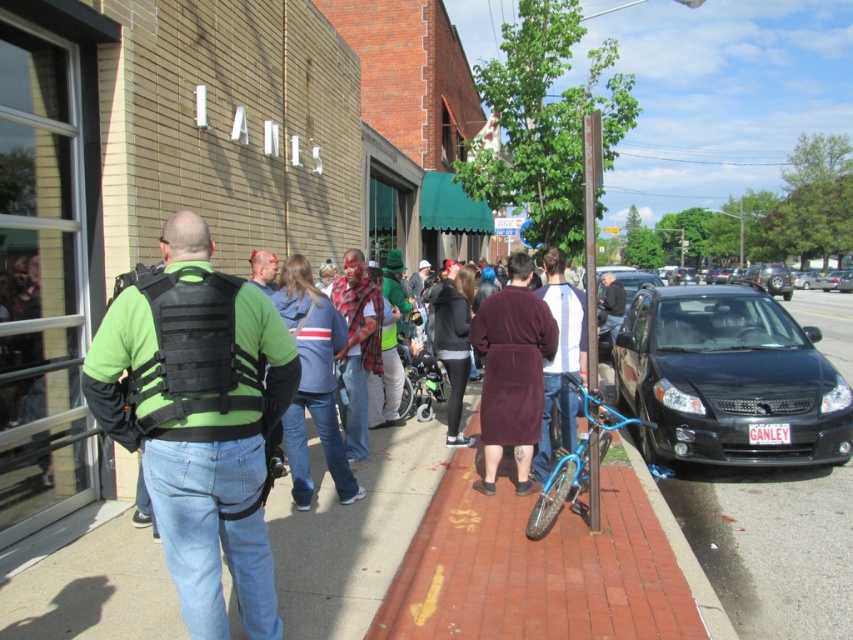
What are the coordinates of the black glossy sedan at right?

The black glossy sedan at right is located at coordinates point (728, 380).